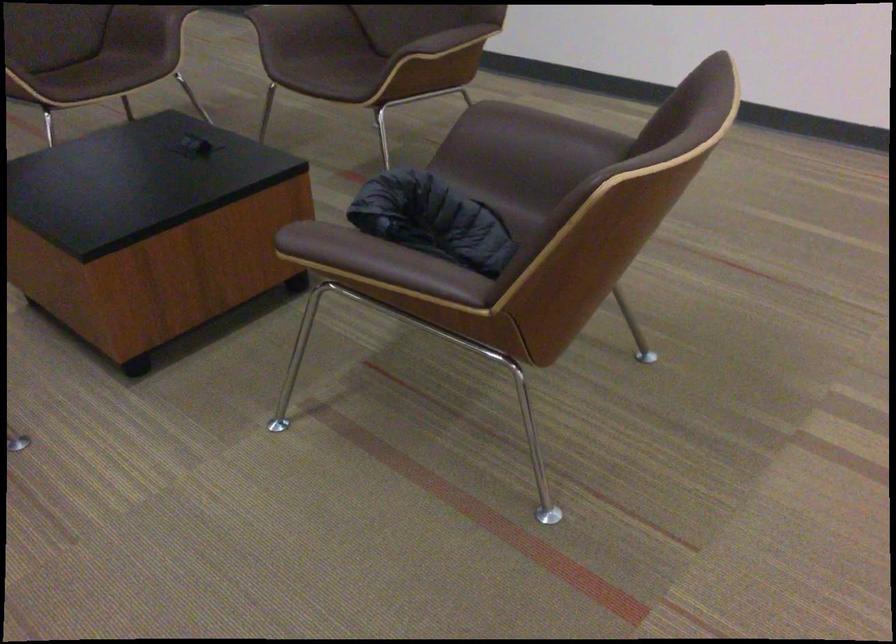
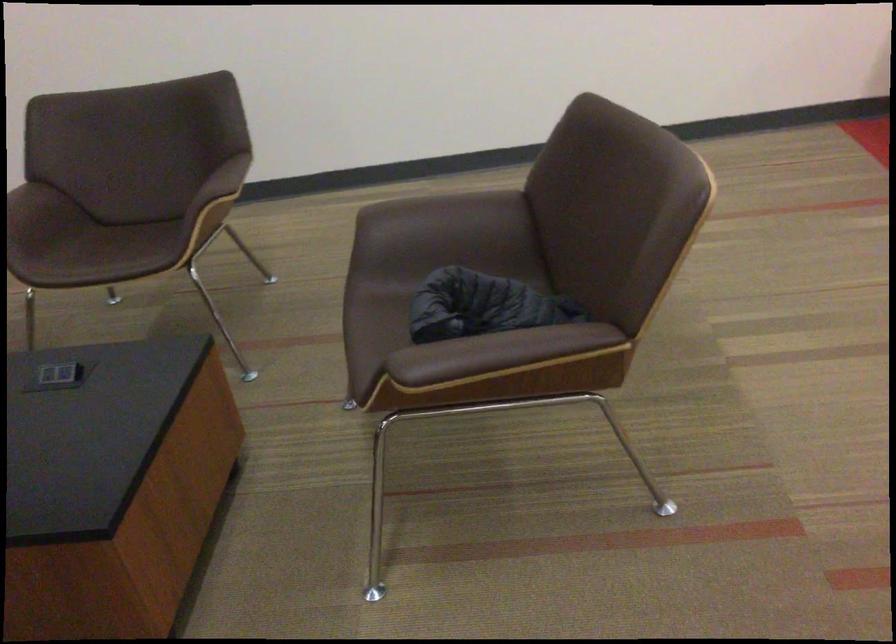
Question: The camera is either moving clockwise (left) or counter-clockwise (right) around the object. The first image is from the beginning of the video and the second image is from the end. Is the camera moving left or right when shooting the video?

Choices:
 (A) Left
 (B) Right

Answer: (A)